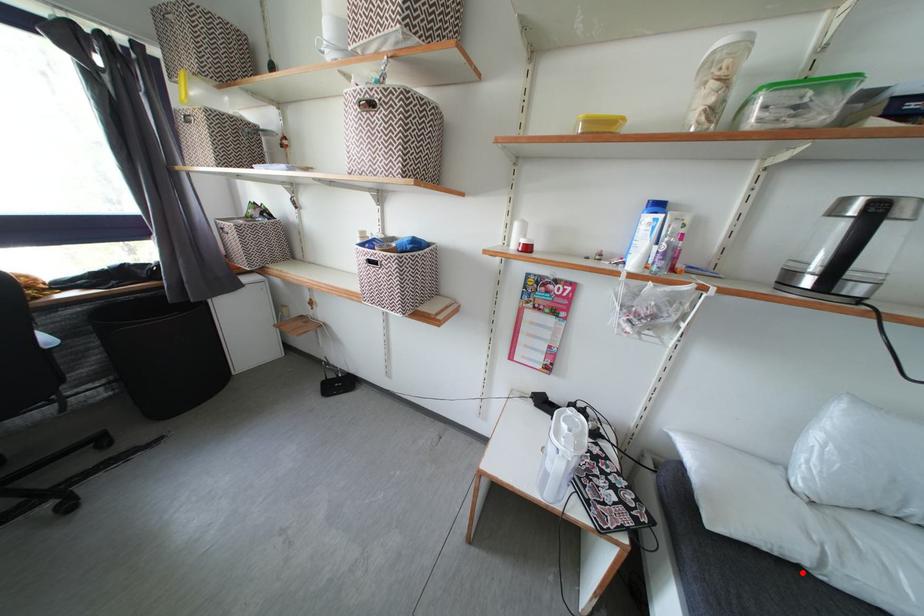
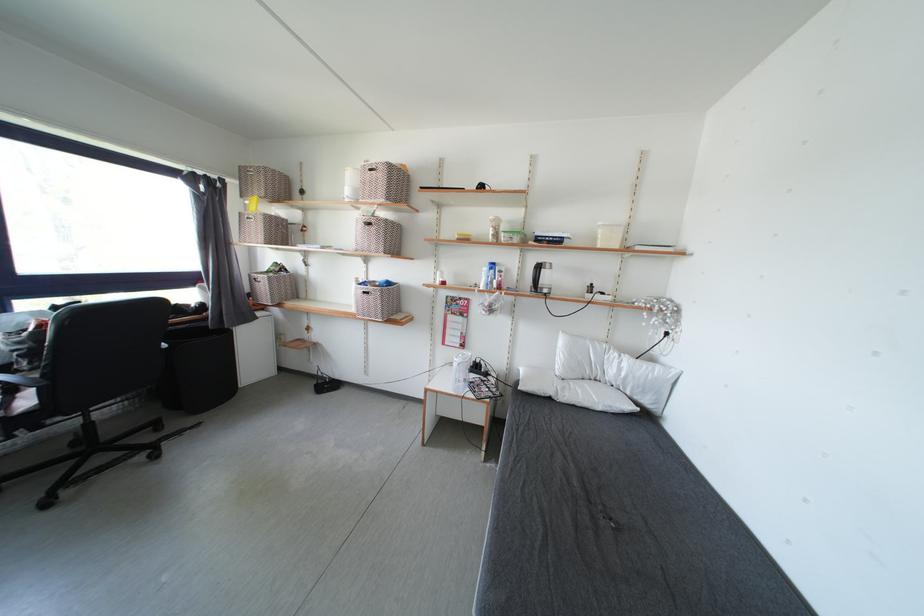
In the second image, find the point that corresponds to the highlighted location in the first image.

(556, 403)